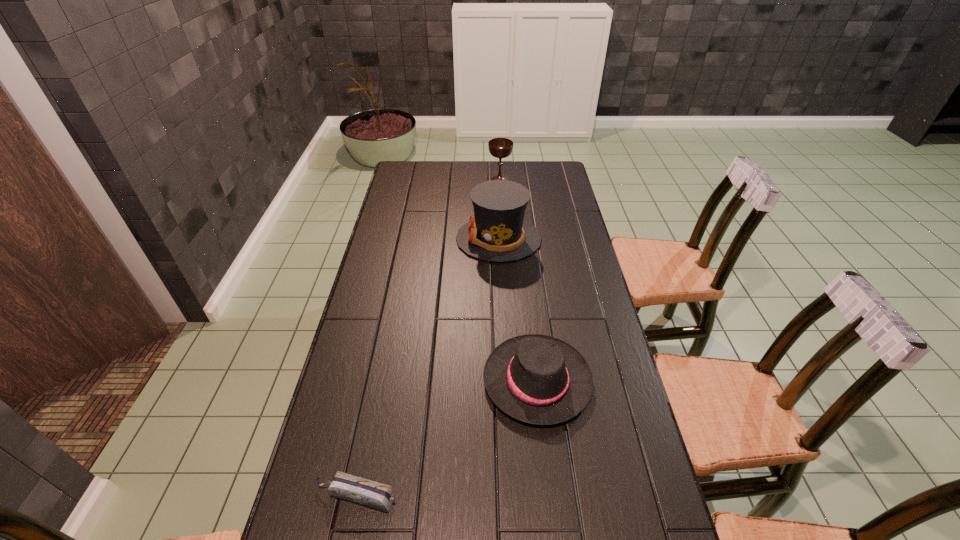
You are a GUI agent. You are given a task and a screenshot of the screen. Output one action in this format:
    pyautogui.click(x=<x>, y=<y>)
    Task: Click on the second closest object to the second farthest object
    This screenshot has width=960, height=540.
    Given the screenshot: What is the action you would take?
    pyautogui.click(x=538, y=379)

Select which object is the third closest to the taller dress hat. Please provide its 2D coordinates. Your answer should be formatted as a tuple, i.e. [(x, y)], where the tuple contains the x and y coordinates of a point satisfying the conditions above.

[(376, 495)]

Identify the location of free space that satisfies the following two spatial constraints: 1. with goggles on the front of the third nearest object; 2. on the right side of the shorter dress hat. The height and width of the screenshot is (540, 960). (506, 380).

Where is `vacant space that satisfies the following two spatial constraints: 1. with goggles on the front of the third nearest object; 2. on the left side of the second nearest object`? This screenshot has height=540, width=960. vacant space that satisfies the following two spatial constraints: 1. with goggles on the front of the third nearest object; 2. on the left side of the second nearest object is located at coordinates (x=506, y=380).

What are the coordinates of `vacant area in the image that satisfies the following two spatial constraints: 1. with goggles on the front of the farther dress hat; 2. on the right side of the second shortest object` in the screenshot? It's located at [506, 380].